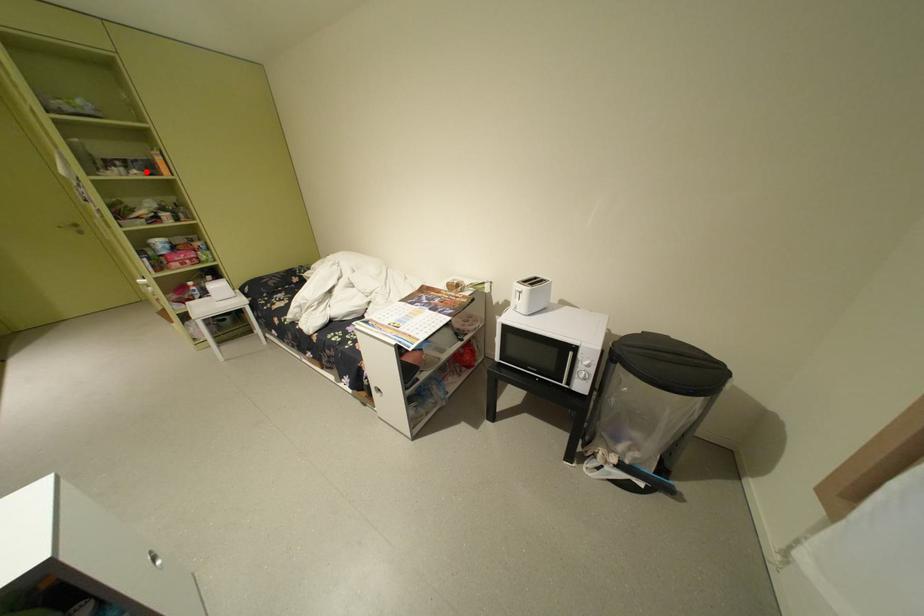
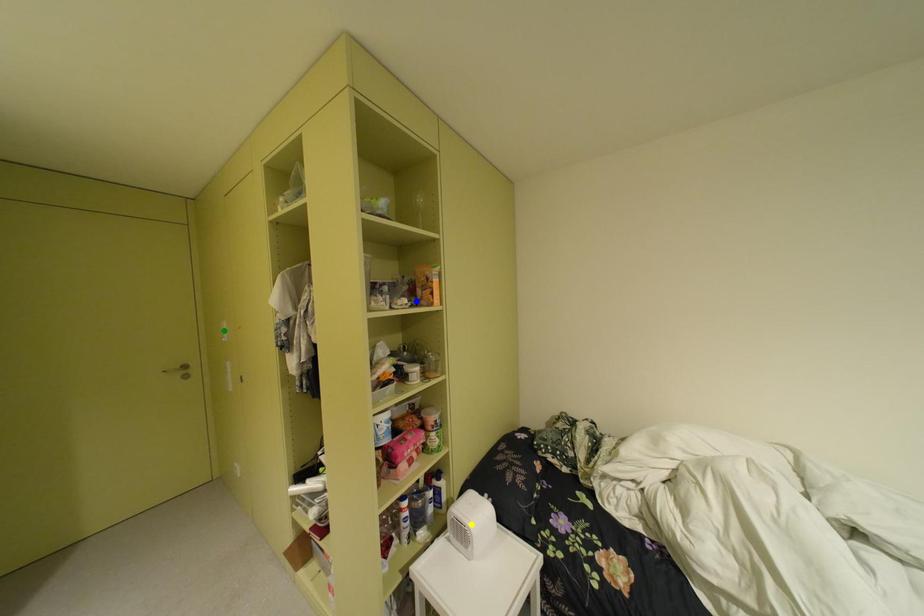
Question: I am providing you with two images of the same scene from different viewpoints. A red point is marked on the first image. You are given multiple points on the second image. Which point in image 2 is actually the same real-world point as the red point in image 1?

Choices:
 (A) yellow point
 (B) blue point
 (C) green point

Answer: (B)